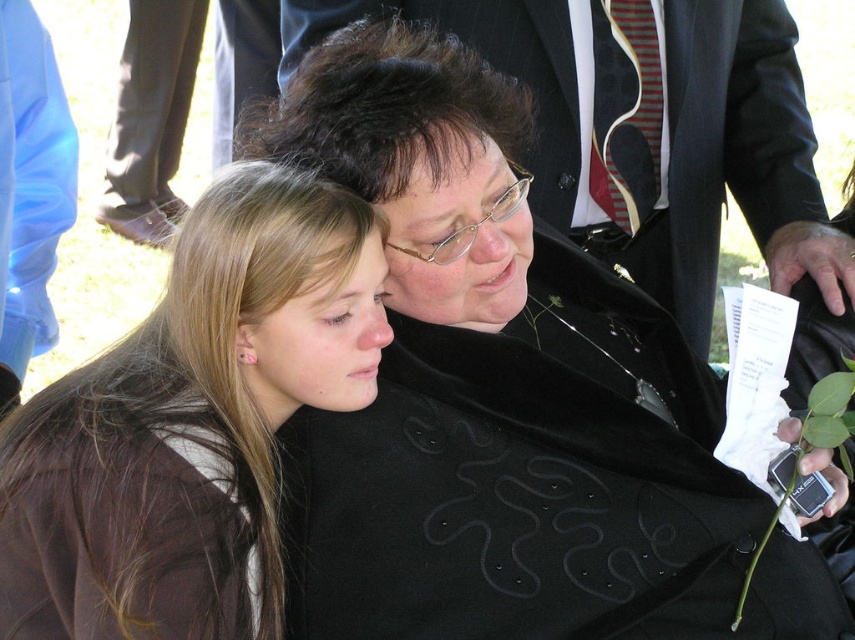
Who is more distant from viewer, (87, 568) or (435, 3)?

The point (435, 3) is behind.

Is point (281, 380) positioned behind point (680, 177)?

No.

What do you see at coordinates (192, 422) in the screenshot? I see `brown hair at left` at bounding box center [192, 422].

This screenshot has width=855, height=640. Find the location of `brown hair at left`. brown hair at left is located at coordinates (192, 422).

Who is higher up, matte black coat at center or dark brown silky hair at center?

matte black coat at center

Can you confirm if matte black coat at center is positioned above dark brown silky hair at center?

Yes.

Is point (846, 292) positioned in front of point (392, 67)?

No, it is not.

Where is `matte black coat at center`? The width and height of the screenshot is (855, 640). matte black coat at center is located at coordinates (647, 131).

Who is lower down, brown hair at left or dark brown silky hair at center?

brown hair at left is below.

Is brown hair at left closer to the viewer compared to dark brown silky hair at center?

Yes, it is.

Which is behind, point (181, 509) or point (338, 166)?

The point (338, 166) is more distant.

You are a GUI agent. You are given a task and a screenshot of the screen. Output one action in this format:
    pyautogui.click(x=<x>, y=<y>)
    Task: Click on the brown hair at left
    The width and height of the screenshot is (855, 640).
    Given the screenshot: What is the action you would take?
    192,422